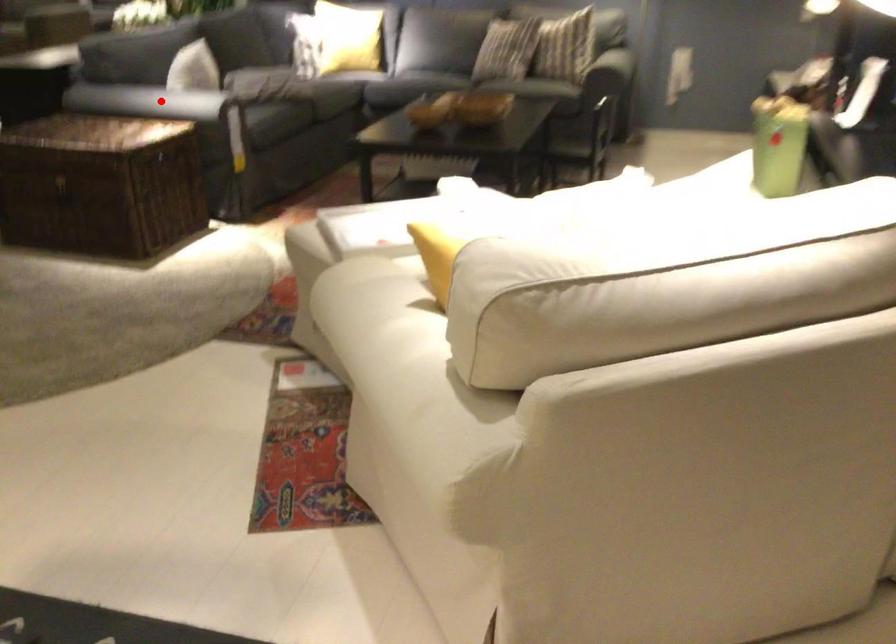
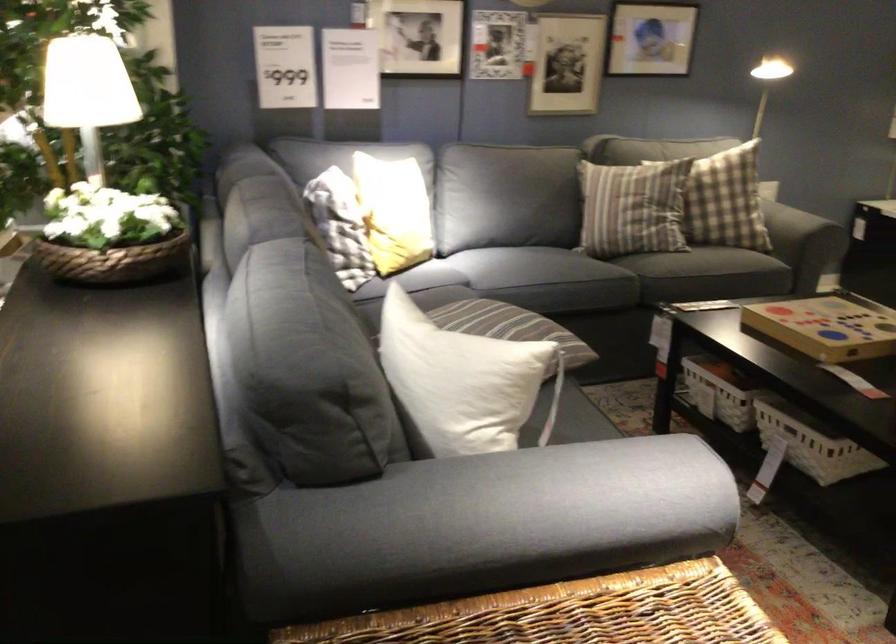
Where in the second image is the point corresponding to the highlighted location from the first image?

(528, 500)